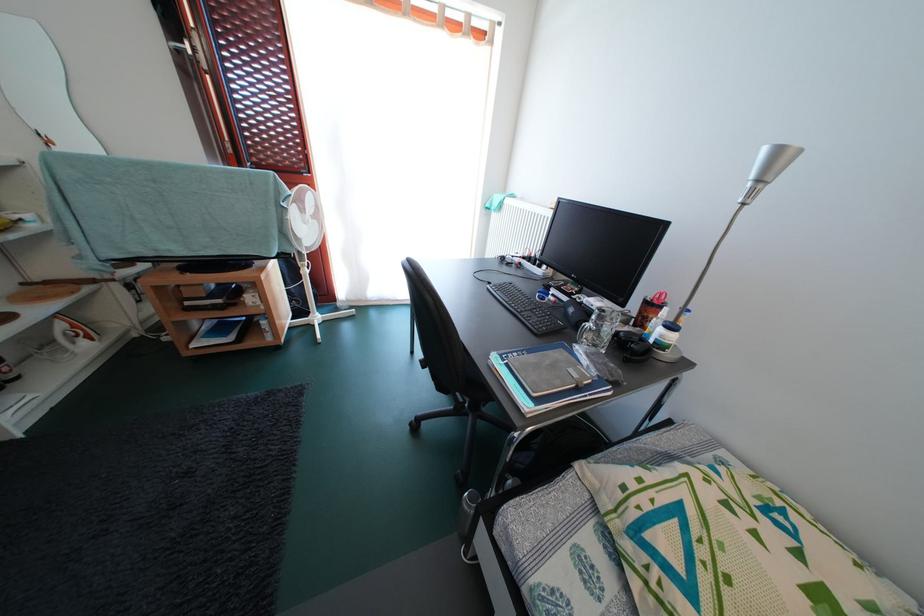
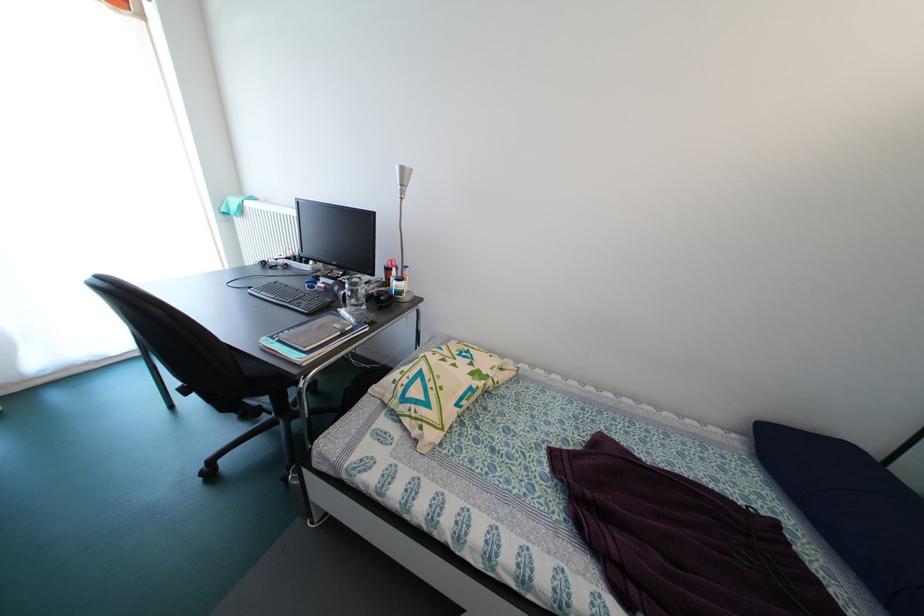
Find the pixel in the second image that matches point (578, 315) in the first image.

(344, 294)